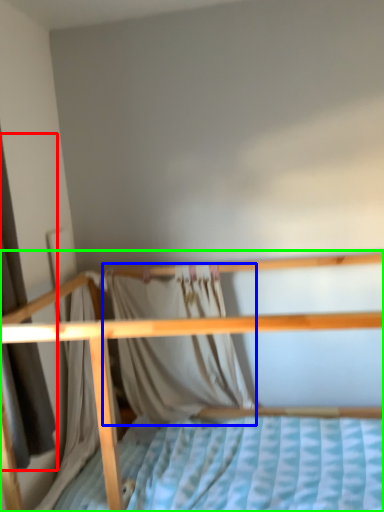
Question: Which is farther away from curtain (highlighted by a red box)? curtain (highlighted by a blue box) or bed (highlighted by a green box)?

Choices:
 (A) curtain
 (B) bed

Answer: (A)